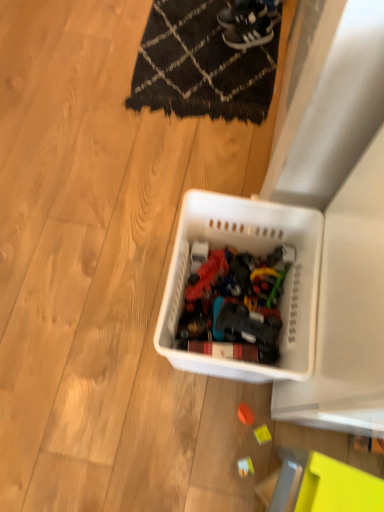
Identify the location of vacant region to the left of white leather sneakers at upper center, which is the second footwear from top to bottom. The width and height of the screenshot is (384, 512). (199, 36).